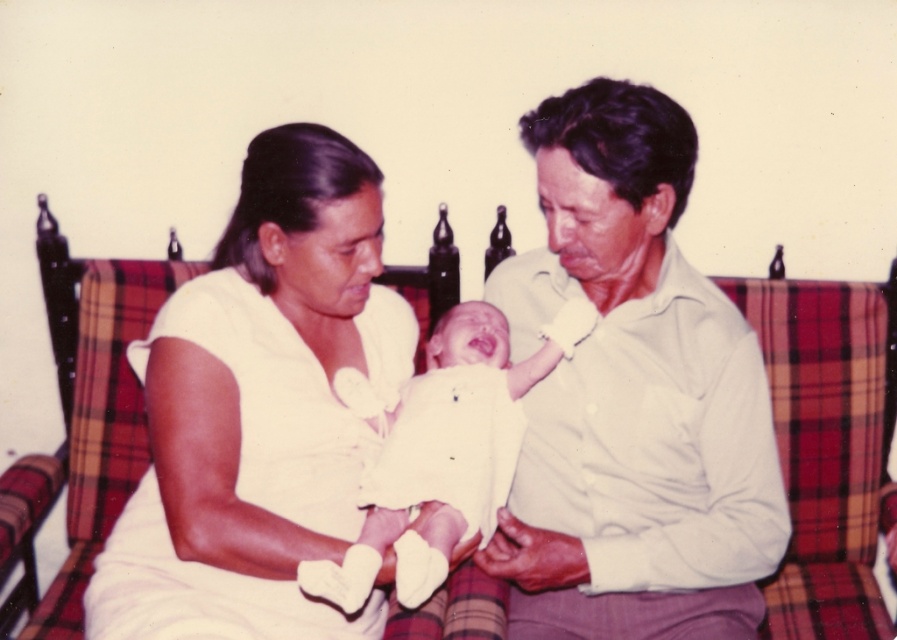
Which is more to the left, white cotton shirt at center or plaid fabric couch at center?

white cotton shirt at center

Is point (620, 380) behind point (102, 467)?

No, (620, 380) is closer to viewer.

Who is more distant from viewer, (580, 602) or (820, 419)?

Point (820, 419)

Locate an element on the screen. white cotton shirt at center is located at coordinates (632, 397).

Who is higher up, white fabric dress at center or plaid fabric couch at center?

white fabric dress at center

Image resolution: width=897 pixels, height=640 pixels. I want to click on white fabric dress at center, so click(258, 410).

What do you see at coordinates (258, 410) in the screenshot? I see `white fabric dress at center` at bounding box center [258, 410].

Image resolution: width=897 pixels, height=640 pixels. I want to click on white fabric dress at center, so click(x=258, y=410).

Does white cotton shirt at center appear over white soft fabric baby at center?

Correct, white cotton shirt at center is located above white soft fabric baby at center.

Where is `white cotton shirt at center`? The height and width of the screenshot is (640, 897). white cotton shirt at center is located at coordinates (632, 397).

Between point (530, 120) and point (462, 467), which one is positioned behind?

The point (530, 120) is more distant.

Find the location of a particular element. The width and height of the screenshot is (897, 640). white cotton shirt at center is located at coordinates (632, 397).